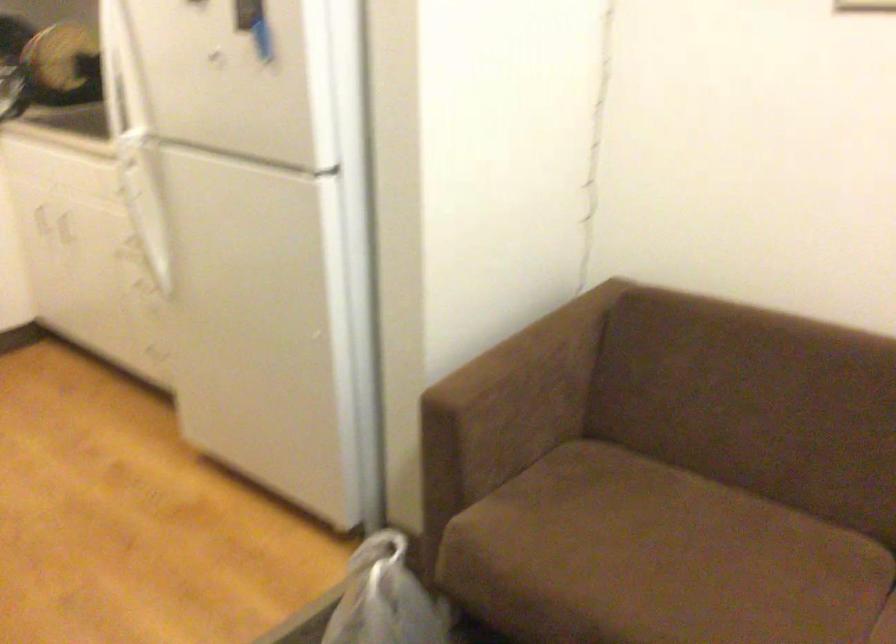
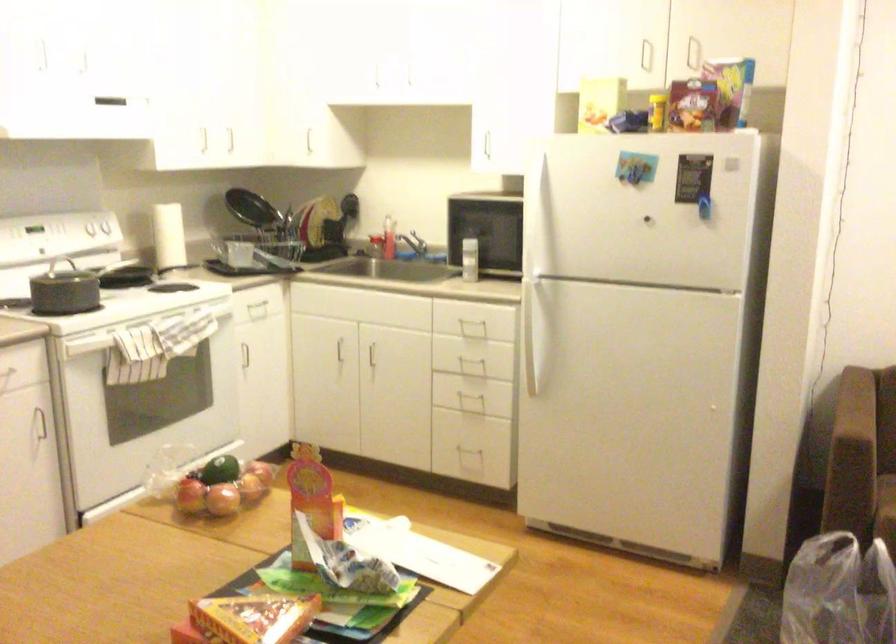
Where in the second image is the point corresponding to point 154,243 from the first image?

(536, 350)